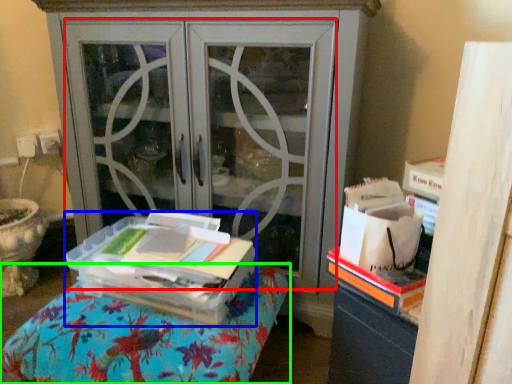
Question: Which is nearer to the screen door (highlighted by a red box)? cardboard box (highlighted by a blue box) or furniture (highlighted by a green box).

Choices:
 (A) cardboard box
 (B) furniture

Answer: (A)